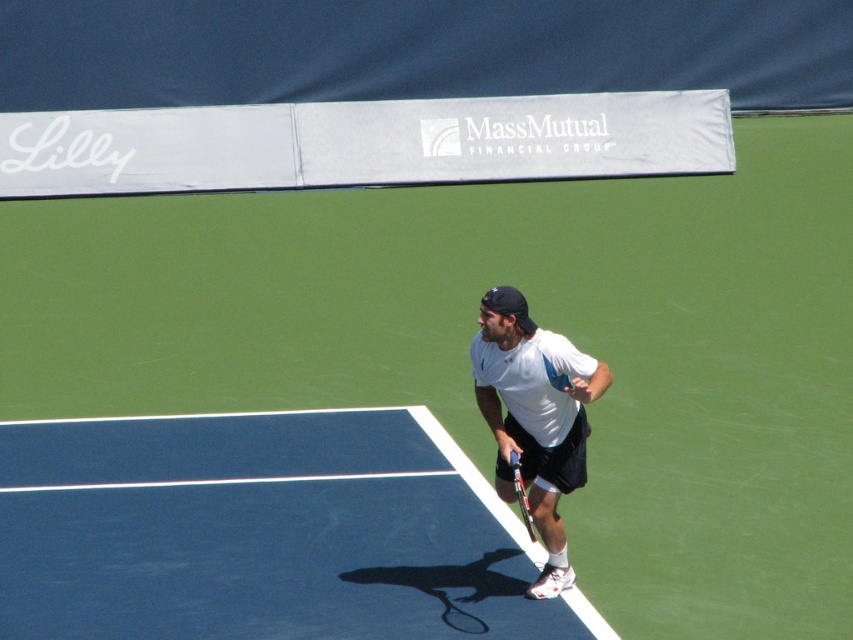
Question: Does blue rubber tennis court at center lie in front of black metallic tennis racket at lower center?

Choices:
 (A) no
 (B) yes

Answer: (A)

Question: Which of these objects is positioned closest to the blue rubber tennis court at center?

Choices:
 (A) black metallic tennis racket at lower center
 (B) white matte tennis racket at center

Answer: (B)

Question: Is white matte tennis racket at center to the right of black metallic tennis racket at lower center from the viewer's perspective?

Choices:
 (A) yes
 (B) no

Answer: (A)

Question: Among these objects, which one is nearest to the camera?

Choices:
 (A) blue rubber tennis court at center
 (B) black metallic tennis racket at lower center
 (C) white matte tennis racket at center

Answer: (C)

Question: Which point is closer to the camera?

Choices:
 (A) black metallic tennis racket at lower center
 (B) blue rubber tennis court at center

Answer: (A)

Question: Observing the image, what is the correct spatial positioning of blue rubber tennis court at center in reference to white matte tennis racket at center?

Choices:
 (A) right
 (B) left

Answer: (B)